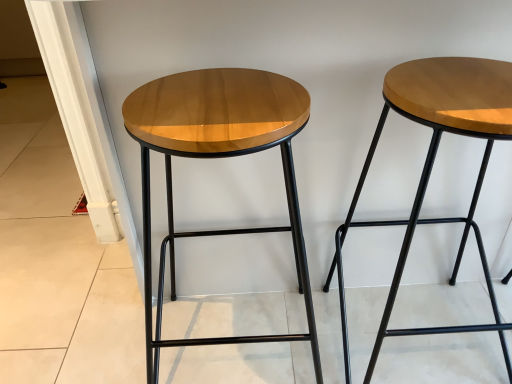
Question: From their relative heights in the image, would you say glossy wood stool at right, which ranks as the second stool in left-to-right order, is taller or shorter than glossy wood stool at left, placed as the second stool when sorted from right to left?

Choices:
 (A) short
 (B) tall

Answer: (A)

Question: In the image, is glossy wood stool at right, which ranks as the second stool in left-to-right order, positioned in front of or behind glossy wood stool at left, placed as the second stool when sorted from right to left?

Choices:
 (A) behind
 (B) front

Answer: (A)

Question: Considering the positions of glossy wood stool at right, which ranks as the second stool in left-to-right order, and glossy wood stool at left, the 1th stool positioned from the left, in the image, is glossy wood stool at right, which ranks as the second stool in left-to-right order, bigger or smaller than glossy wood stool at left, the 1th stool positioned from the left,?

Choices:
 (A) big
 (B) small

Answer: (B)

Question: From the image's perspective, relative to glossy wood stool at right, the 1th stool from the right, is glossy wood stool at left, placed as the second stool when sorted from right to left, above or below?

Choices:
 (A) above
 (B) below

Answer: (B)

Question: Would you say glossy wood stool at left, placed as the second stool when sorted from right to left, is inside or outside glossy wood stool at right, the 1th stool from the right?

Choices:
 (A) outside
 (B) inside

Answer: (A)

Question: In the image, is glossy wood stool at left, the 1th stool positioned from the left, on the left side or the right side of glossy wood stool at right, which ranks as the second stool in left-to-right order?

Choices:
 (A) left
 (B) right

Answer: (A)

Question: Looking at the image, does glossy wood stool at left, the 1th stool positioned from the left, seem bigger or smaller compared to glossy wood stool at right, the 1th stool from the right?

Choices:
 (A) small
 (B) big

Answer: (B)